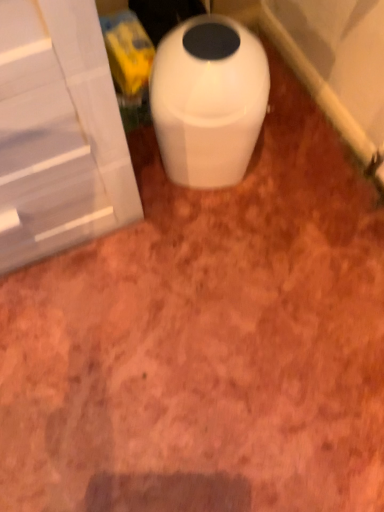
Question: From a real-world perspective, is white glossy screen door at left physically below white glossy trash can at center?

Choices:
 (A) yes
 (B) no

Answer: (B)

Question: Is white glossy screen door at left positioned behind white glossy trash can at center?

Choices:
 (A) yes
 (B) no

Answer: (B)

Question: Is white glossy screen door at left at the right side of white glossy trash can at center?

Choices:
 (A) yes
 (B) no

Answer: (B)

Question: Does white glossy screen door at left have a smaller size compared to white glossy trash can at center?

Choices:
 (A) no
 (B) yes

Answer: (A)

Question: Is white glossy screen door at left positioned with its back to white glossy trash can at center?

Choices:
 (A) yes
 (B) no

Answer: (B)

Question: Considering the relative sizes of white glossy screen door at left and white glossy trash can at center in the image provided, is white glossy screen door at left bigger than white glossy trash can at center?

Choices:
 (A) no
 (B) yes

Answer: (B)

Question: From a real-world perspective, is white glossy trash can at center beneath white glossy screen door at left?

Choices:
 (A) no
 (B) yes

Answer: (B)

Question: Considering the relative positions of white glossy trash can at center and white glossy screen door at left in the image provided, is white glossy trash can at center to the left of white glossy screen door at left from the viewer's perspective?

Choices:
 (A) no
 (B) yes

Answer: (A)

Question: Can you confirm if white glossy trash can at center is smaller than white glossy screen door at left?

Choices:
 (A) yes
 (B) no

Answer: (A)

Question: From a real-world perspective, is white glossy trash can at center physically above white glossy screen door at left?

Choices:
 (A) no
 (B) yes

Answer: (A)

Question: Does white glossy trash can at center have a greater height compared to white glossy screen door at left?

Choices:
 (A) yes
 (B) no

Answer: (B)

Question: Could white glossy screen door at left be considered to be inside white glossy trash can at center?

Choices:
 (A) yes
 (B) no

Answer: (B)

Question: From a real-world perspective, is white glossy trash can at center physically located above or below white glossy screen door at left?

Choices:
 (A) above
 (B) below

Answer: (B)